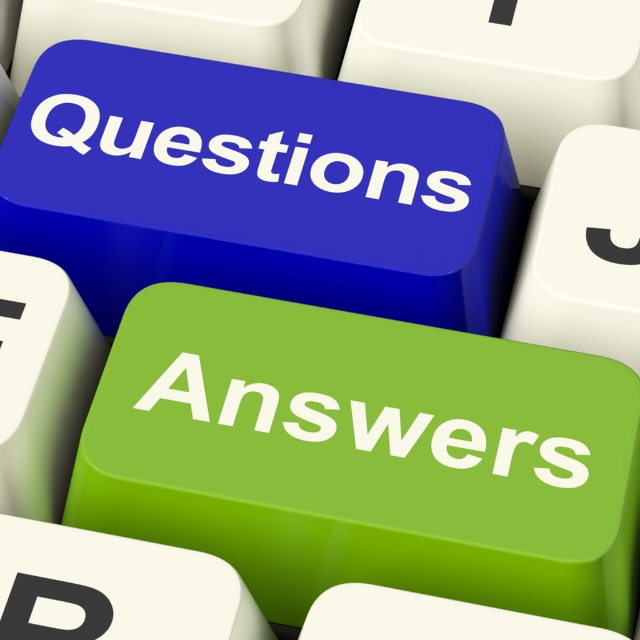
Question: Does blue plastic questions at upper center have a lesser width compared to green matte/soft answers at center?

Choices:
 (A) yes
 (B) no

Answer: (B)

Question: Which point is farther to the camera?

Choices:
 (A) 422,180
 (B) 308,410

Answer: (A)

Question: Can you confirm if blue plastic questions at upper center is bigger than green matte/soft answers at center?

Choices:
 (A) yes
 (B) no

Answer: (A)

Question: Where is blue plastic questions at upper center located in relation to green matte/soft answers at center in the image?

Choices:
 (A) right
 (B) left

Answer: (B)